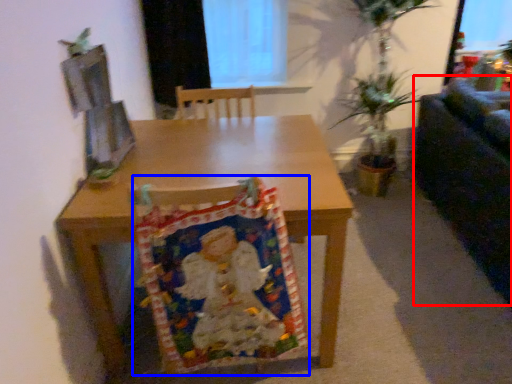
Question: Which object appears farthest to the camera in this image, couch (highlighted by a red box) or blanket (highlighted by a blue box)?

Choices:
 (A) couch
 (B) blanket

Answer: (A)